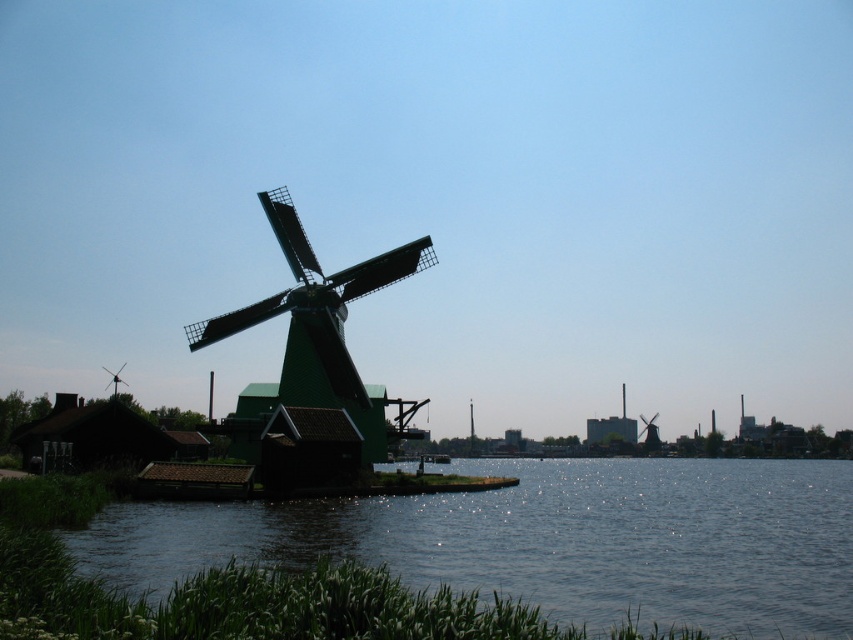
You are an architect designing a new pathway that needs to pass between the green smooth water at lower left and the green matte windmill at center. Based on their heights, which object should the pathway be elevated above to ensure safety?

The pathway should be elevated above the green matte windmill at center because it has a greater height than the green smooth water at lower left, as stated in the description.

You are standing at the center of the image and want to walk to the green smooth water at lower left. Which direction should you face to head directly towards it?

You should face the lower left direction to head directly towards the green smooth water at lower left since it is located at point (547,540).

You are standing at the point marked by the coordinates point (x=547, y=540), which is green smooth water at lower left. What is the nearest object to you in the scene?

The nearest object to the point (x=547, y=540) is the green smooth water at lower left itself, as it is the location where you are standing.